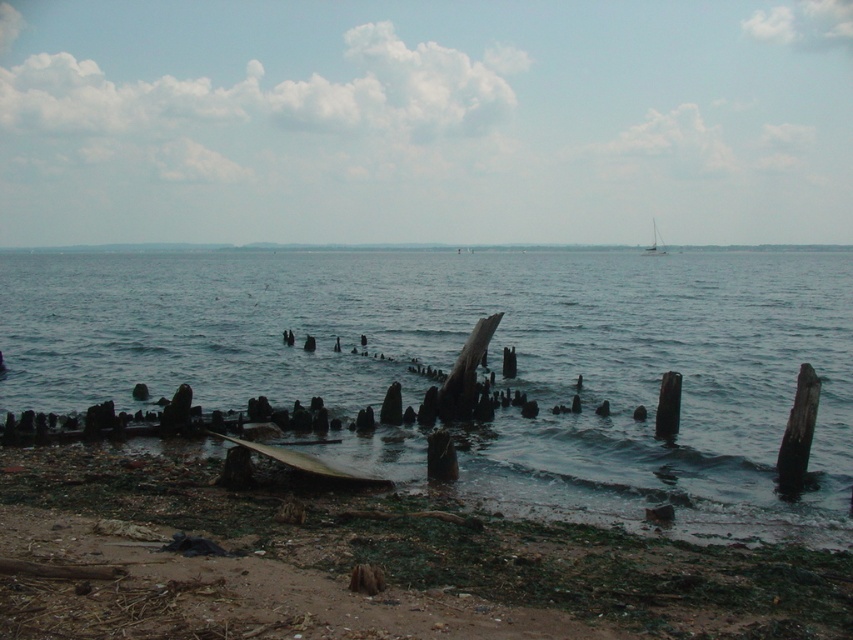
Does blue water at center have a greater height compared to white plastic sailboat at upper center?

In fact, blue water at center may be shorter than white plastic sailboat at upper center.

This screenshot has width=853, height=640. I want to click on blue water at center, so click(488, 358).

Find the location of a particular element. The height and width of the screenshot is (640, 853). blue water at center is located at coordinates (488, 358).

Between brown dirt at lower left and white plastic sailboat at upper center, which one appears on the left side from the viewer's perspective?

Positioned to the left is brown dirt at lower left.

Does point (283, 593) come closer to viewer compared to point (653, 248)?

Yes, it is in front of point (653, 248).

This screenshot has height=640, width=853. Identify the location of brown dirt at lower left. (372, 564).

Is point (778, 284) farther from camera compared to point (151, 620)?

Yes, point (778, 284) is behind point (151, 620).

Is blue water at center below brown dirt at lower left?

No, blue water at center is not below brown dirt at lower left.

Does point (149, 372) come farther from viewer compared to point (186, 560)?

Yes, it is.

Locate an element on the screen. This screenshot has width=853, height=640. blue water at center is located at coordinates point(488,358).